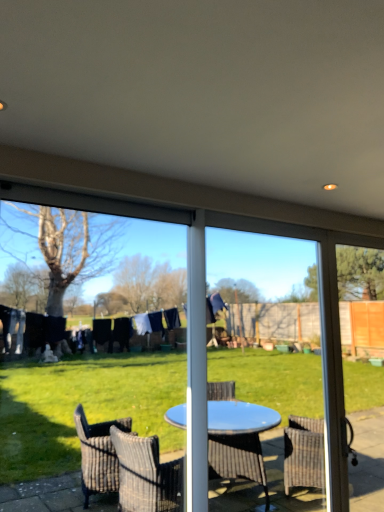
The height and width of the screenshot is (512, 384). Find the location of `vacant point above transparent plastic screen at center (from a real-world perspective)`. vacant point above transparent plastic screen at center (from a real-world perspective) is located at coordinates (130, 209).